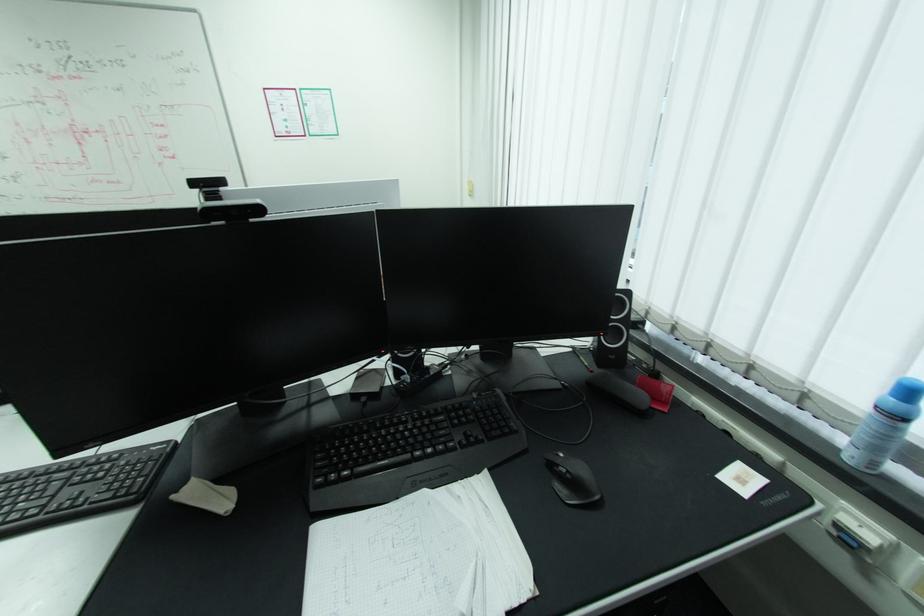
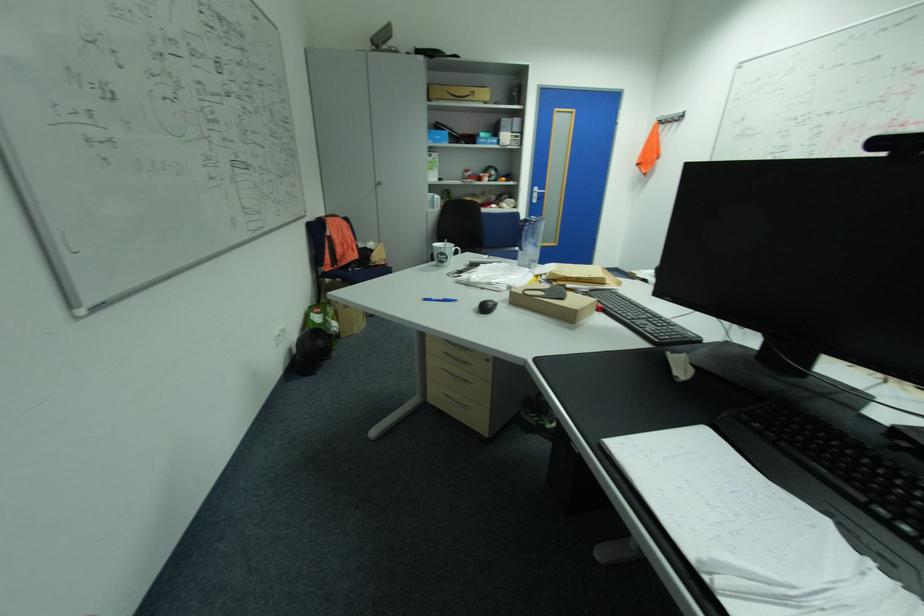
Consider the image. Based on the continuous images, in which direction is the camera rotating?

The camera's rotation is toward left-down.